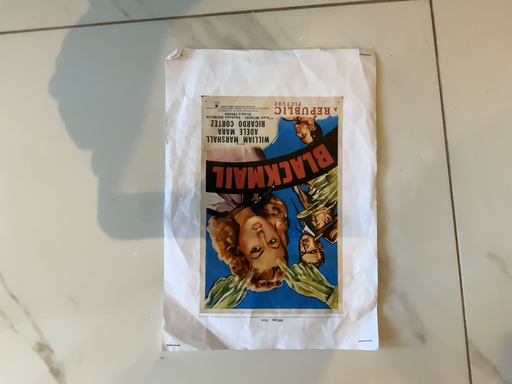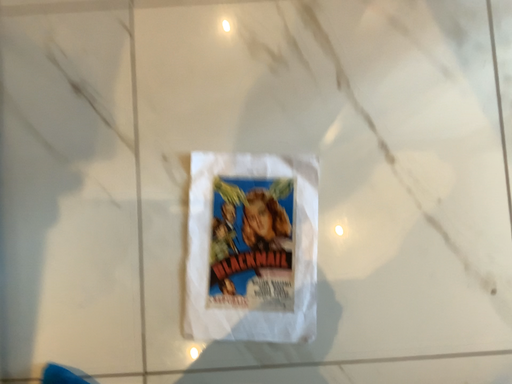
Question: Which way did the camera rotate in the video?

Choices:
 (A) rotated upward
 (B) rotated downward

Answer: (A)